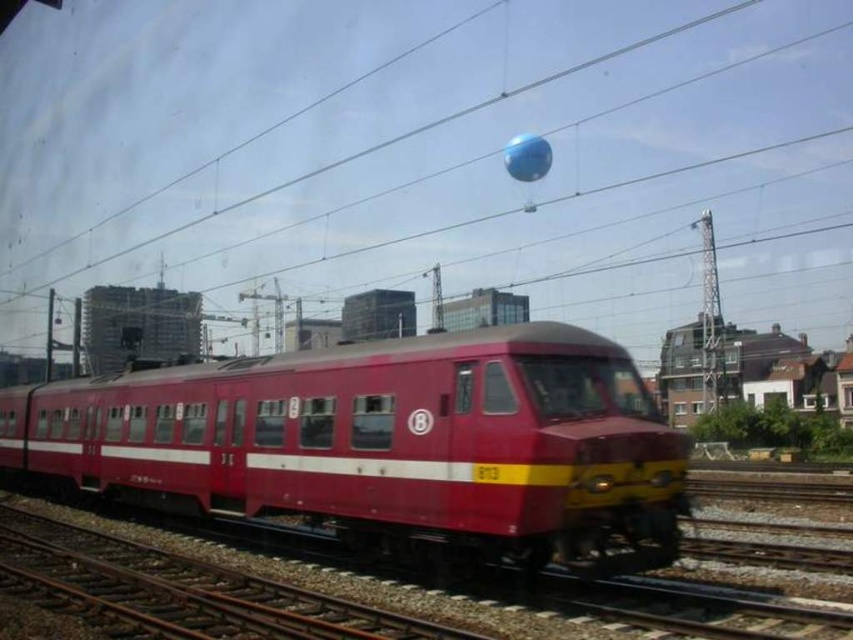
Can you confirm if matte red train at center is bigger than blue rubber balloon at upper center?

No.

Is matte red train at center taller than blue rubber balloon at upper center?

Incorrect, matte red train at center's height is not larger of blue rubber balloon at upper center's.

Is point (434, 497) less distant than point (529, 160)?

Yes.

What are the coordinates of `matte red train at center` in the screenshot? It's located at (386, 442).